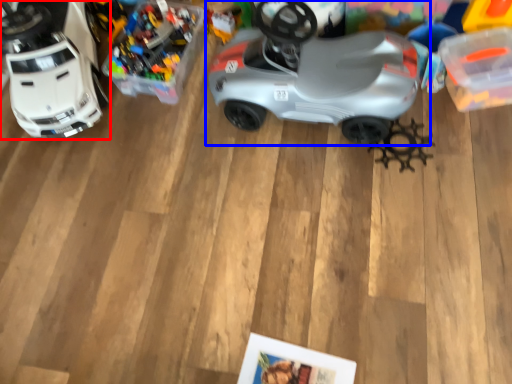
Question: Which object appears farthest to the camera in this image, toy (highlighted by a red box) or car (highlighted by a blue box)?

Choices:
 (A) toy
 (B) car

Answer: (A)